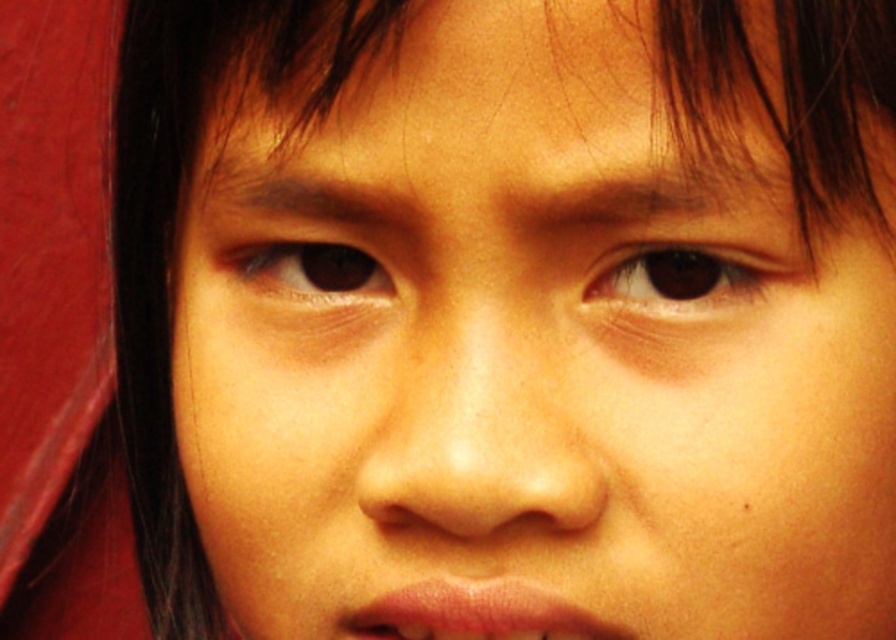
Which is behind, point (607, 275) or point (365, 278)?

Point (365, 278)

Is brown matte eye at upper center above brown matte eye at center?

No.

This screenshot has height=640, width=896. I want to click on brown matte eye at upper center, so click(x=685, y=280).